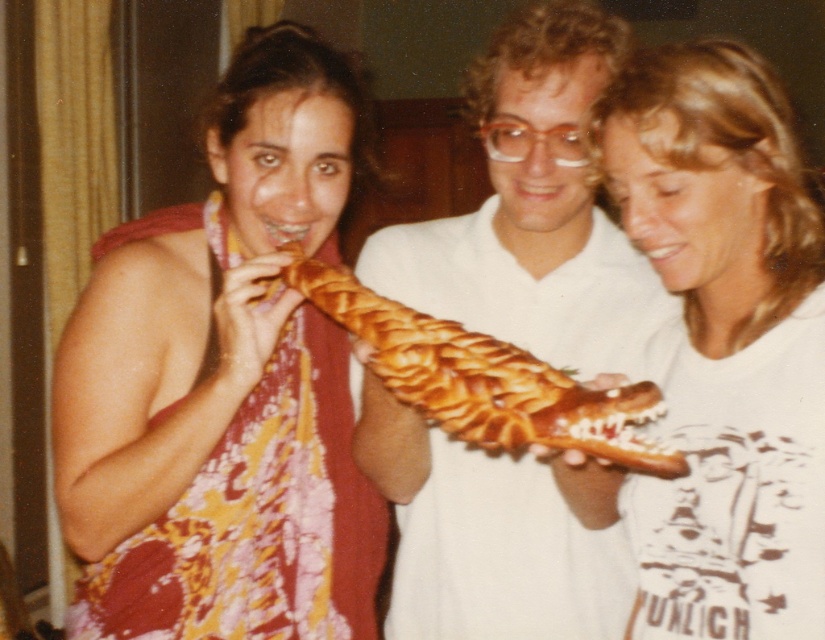
Question: Which of the following is the closest to the observer?

Choices:
 (A) (531, 22)
 (B) (676, 579)
 (C) (503, 346)
 (D) (258, 632)

Answer: (C)

Question: Which object is the farthest from the golden braided bread at center?

Choices:
 (A) matte white shirt at center
 (B) matte yellow dress at center
 (C) white matte t-shirt at center

Answer: (B)

Question: From the image, what is the correct spatial relationship of matte yellow dress at center in relation to white matte t-shirt at center?

Choices:
 (A) right
 (B) left

Answer: (B)

Question: Observing the image, what is the correct spatial positioning of matte yellow dress at center in reference to golden braided bread at center?

Choices:
 (A) left
 (B) right

Answer: (A)

Question: Does white matte t-shirt at center lie in front of golden braided bread at center?

Choices:
 (A) no
 (B) yes

Answer: (A)

Question: Which point appears farthest from the camera in this image?

Choices:
 (A) (611, 323)
 (B) (397, 396)
 (C) (330, 506)
 (D) (710, 132)

Answer: (C)